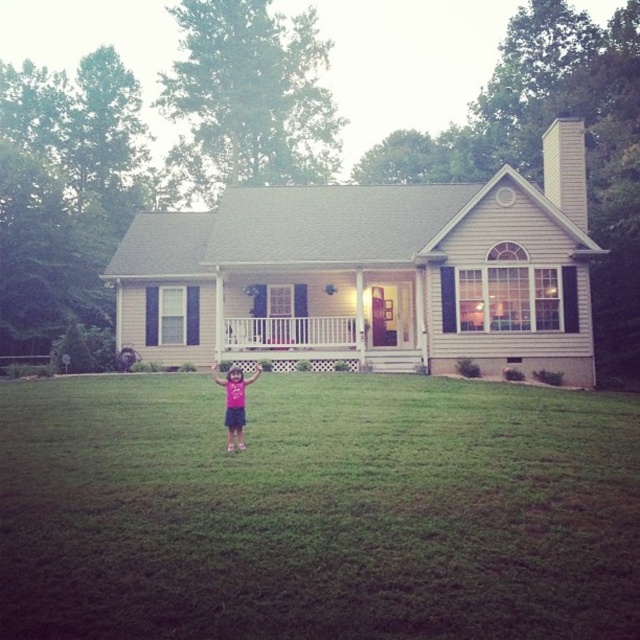
Question: Does green grass at center appear under pink fabric dress at center?

Choices:
 (A) no
 (B) yes

Answer: (B)

Question: Which of these objects is positioned farthest from the green grass at center?

Choices:
 (A) pink fabric dress at center
 (B) white painted wood porch at center

Answer: (B)

Question: Can you confirm if green grass at center is wider than white painted wood porch at center?

Choices:
 (A) no
 (B) yes

Answer: (B)

Question: Among these objects, which one is farthest from the camera?

Choices:
 (A) green grass at center
 (B) pink fabric dress at center

Answer: (B)

Question: Is green grass at center wider than white painted wood porch at center?

Choices:
 (A) no
 (B) yes

Answer: (B)

Question: Estimate the real-world distances between objects in this image. Which object is closer to the green grass at center?

Choices:
 (A) pink fabric dress at center
 (B) white painted wood porch at center

Answer: (A)